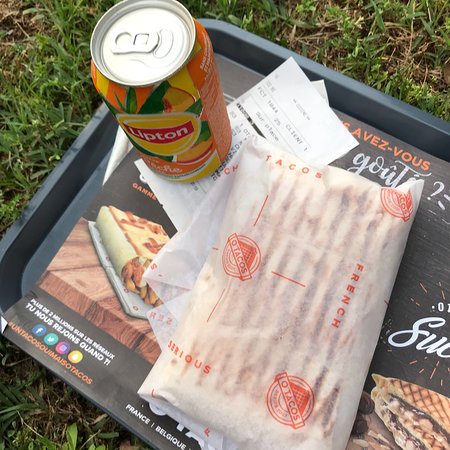
The height and width of the screenshot is (450, 450). Find the location of `paper receipt`. paper receipt is located at coordinates click(x=294, y=100).